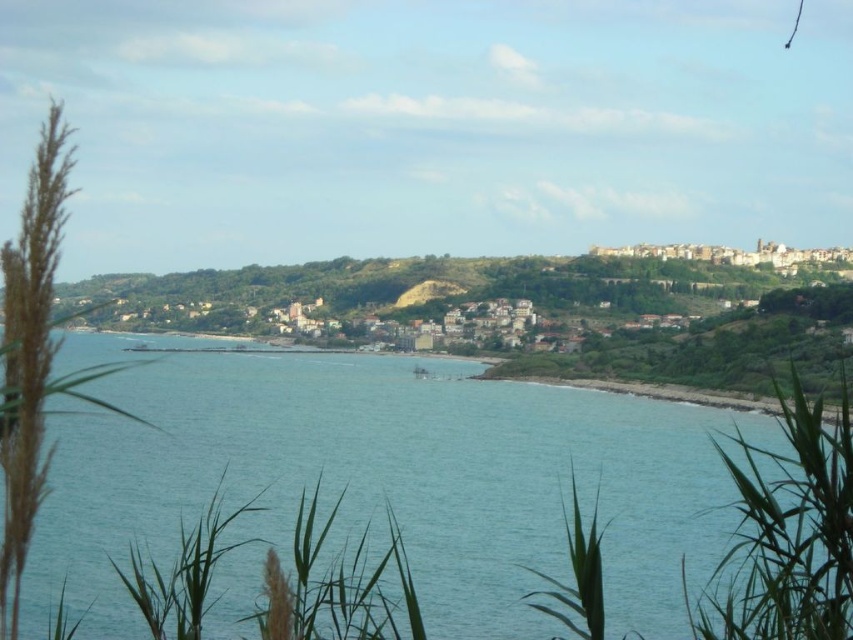
This screenshot has width=853, height=640. Identify the location of clear blue water at center. (393, 483).

Is clear blue water at center wider than green leafy plant at lower right?

Indeed, clear blue water at center has a greater width compared to green leafy plant at lower right.

Is point (634, 477) in front of point (718, 598)?

That is False.

Where is `clear blue water at center`? clear blue water at center is located at coordinates (393, 483).

Locate an element on the screen. green leafy plant at lower right is located at coordinates (786, 532).

This screenshot has width=853, height=640. Identify the location of green leafy plant at lower right. (786, 532).

Between clear blue water at center and green leafy plant at lower center, which one is positioned lower?

green leafy plant at lower center is below.

Who is more forward, (387, 392) or (554, 612)?

Point (554, 612)

Who is more distant from viewer, (657,458) or (577,568)?

Point (657,458)

At what (x,y) coordinates should I click in order to perform the action: click on clear blue water at center. Please return your answer as a coordinate pair (x, y). This screenshot has width=853, height=640. Looking at the image, I should click on (393, 483).